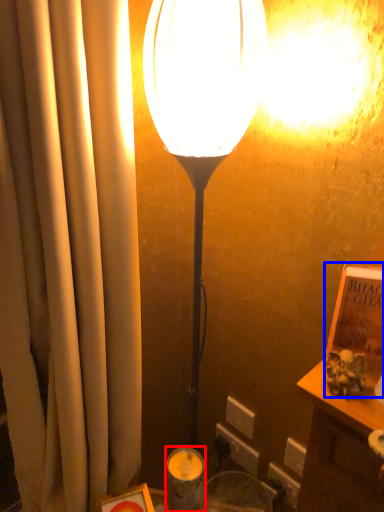
Question: Which object appears farthest to the camera in this image, candle holder (highlighted by a red box) or book (highlighted by a blue box)?

Choices:
 (A) candle holder
 (B) book

Answer: (A)